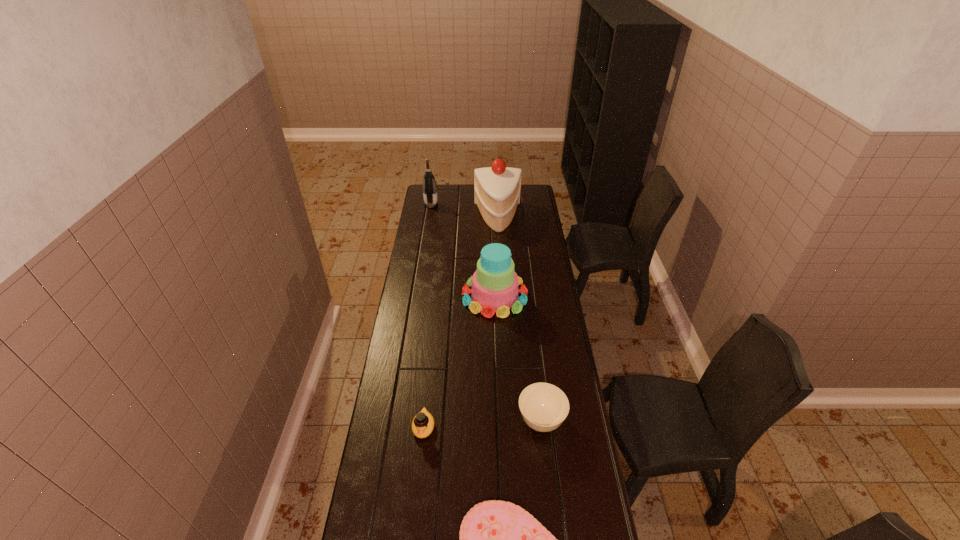
Locate an element on the screen. This screenshot has height=540, width=960. the tallest cake is located at coordinates (497, 189).

Locate an element on the screen. This screenshot has width=960, height=540. the leftmost object is located at coordinates (430, 196).

This screenshot has height=540, width=960. In order to click on the second tallest cake in this screenshot , I will do [494, 284].

Locate an element on the screen. the third farthest object is located at coordinates (494, 284).

Where is `sugar bowl`? Image resolution: width=960 pixels, height=540 pixels. sugar bowl is located at coordinates (543, 406).

The image size is (960, 540). What are the coordinates of `duck` in the screenshot? It's located at (423, 423).

Find the location of a particular element. vacant area situated 0.090m on the right of the tallest cake is located at coordinates (537, 217).

This screenshot has width=960, height=540. I want to click on free space located 0.320m on the label of the leftmost object, so click(491, 205).

Locate an element on the screen. The image size is (960, 540). free location located on the back of the second nearest cake is located at coordinates (492, 250).

At what (x,y) coordinates should I click in order to perform the action: click on free space located on the back of the sugar bowl. Please return your answer as a coordinate pair (x, y). The image size is (960, 540). Looking at the image, I should click on (535, 366).